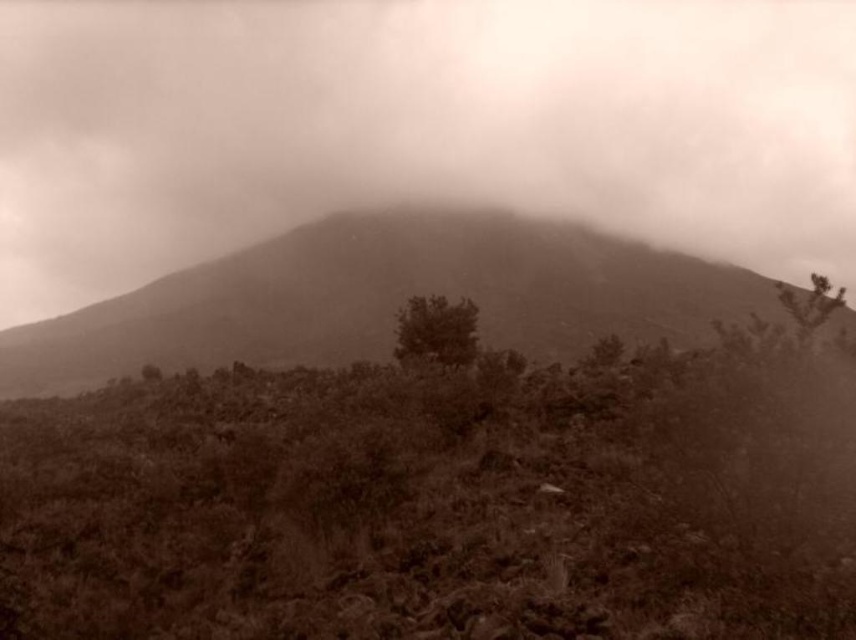
You are a hiker planning to cross the area between the foggy mist at center and the green leafy bush at center. Considering the size difference between them, which one would block your view more when standing in the middle?

The foggy mist at center is bigger than the green leafy bush at center, so the foggy mist at center would block your view more when standing in the middle.

You are an explorer trying to navigate through the sparse vegetation in the foreground. You see the sepia textured mountain at center and the green leafy bush at center. Which object is located to the right of the other?

The sepia textured mountain at center is positioned on the right side of green leafy bush at center, so the mountain is to the right of the bush.